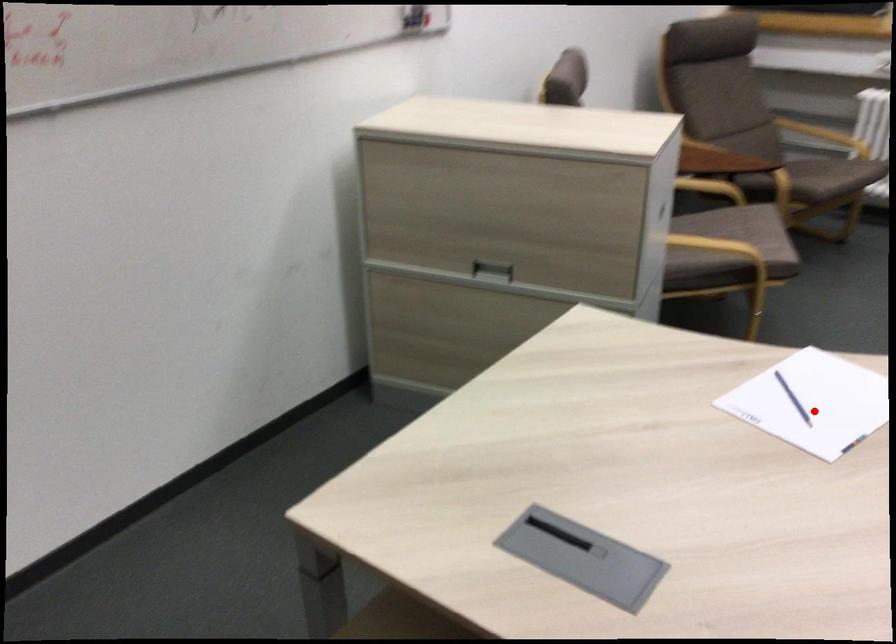
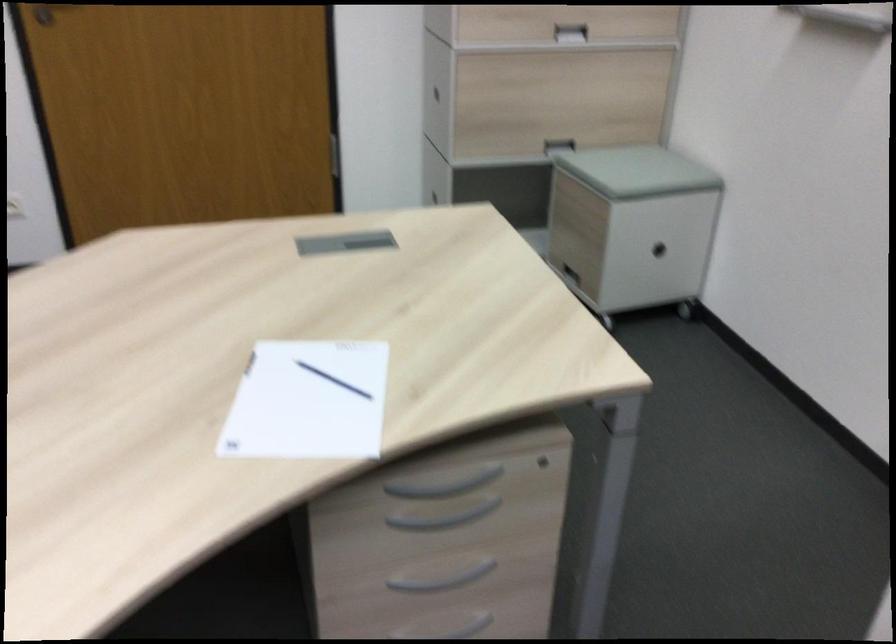
Question: I am providing you with two images of the same scene from different viewpoints. Image1 has a red point marked. In image2, the corresponding 3D location appears at what relative position? Reply with the corresponding letter.

Choices:
 (A) Closer
 (B) Farther

Answer: (A)